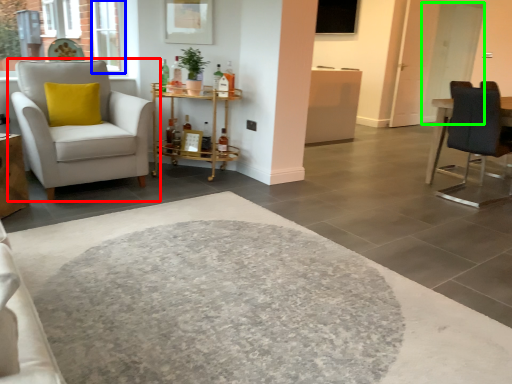
Question: Considering the real-world distances, which object is farthest from chair (highlighted by a red box)? window (highlighted by a blue box) or glass door (highlighted by a green box)?

Choices:
 (A) window
 (B) glass door

Answer: (B)